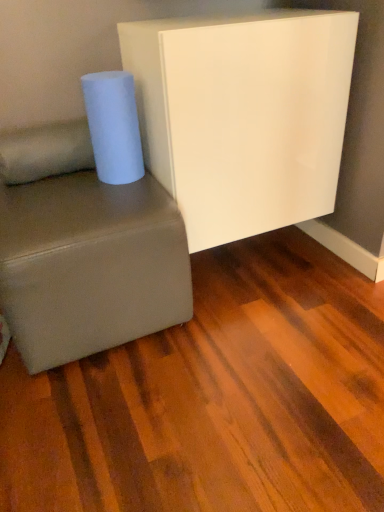
The height and width of the screenshot is (512, 384). Find the location of `free point above suede-like gray studio couch at lower left (from a real-world perspective)`. free point above suede-like gray studio couch at lower left (from a real-world perspective) is located at coordinates (77, 190).